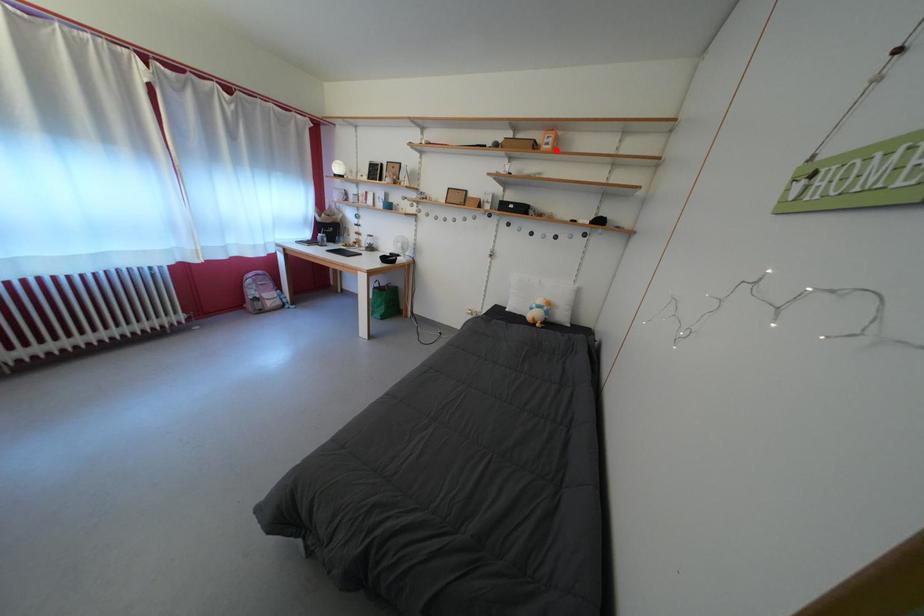
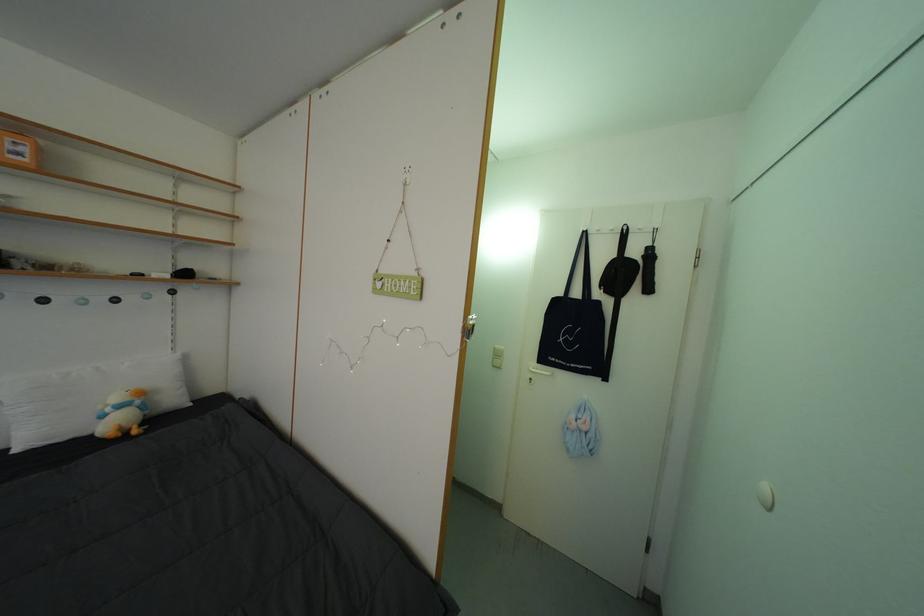
In the second image, find the point that corresponds to the highlighted location in the first image.

(27, 160)